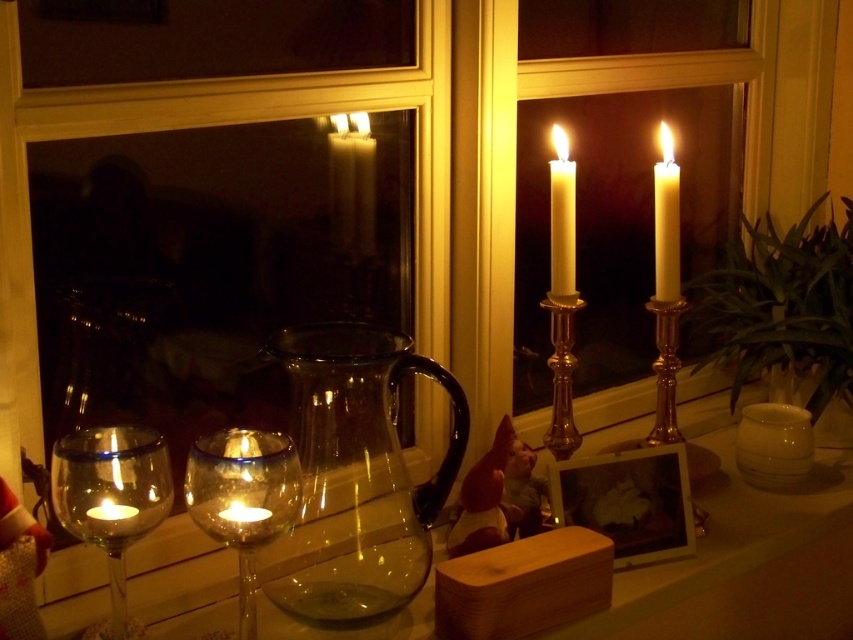
You are setting up a table for a romantic dinner and need to place a white wax candle at upper right into a white glossy candle holder at lower right. Based on the scene description, will the candle fit into the holder?

The white glossy candle holder at lower right might be wider than white wax candle at upper right, so there is a possibility that the candle will fit inside the holder.

You are standing in the room and want to light the translucent glass candle at lower left. If your arm reaches 75 centimeters, can you reach it?

The distance between the translucent glass candle at lower left and the viewer is 74.73 centimeters, so yes, you can reach it since your arm can extend 75 centimeters.

You are standing in the candlelit room and want to place a small decoration on the translucent glass candle at lower left. Given that the candle is at coordinates point (x=111, y=500), can you confirm if this location is suitable for placing the decoration?

The point (x=111, y=500) marks the translucent glass candle at lower left. Since the candle is lit, placing a decoration on it may pose a fire hazard and is not recommended.